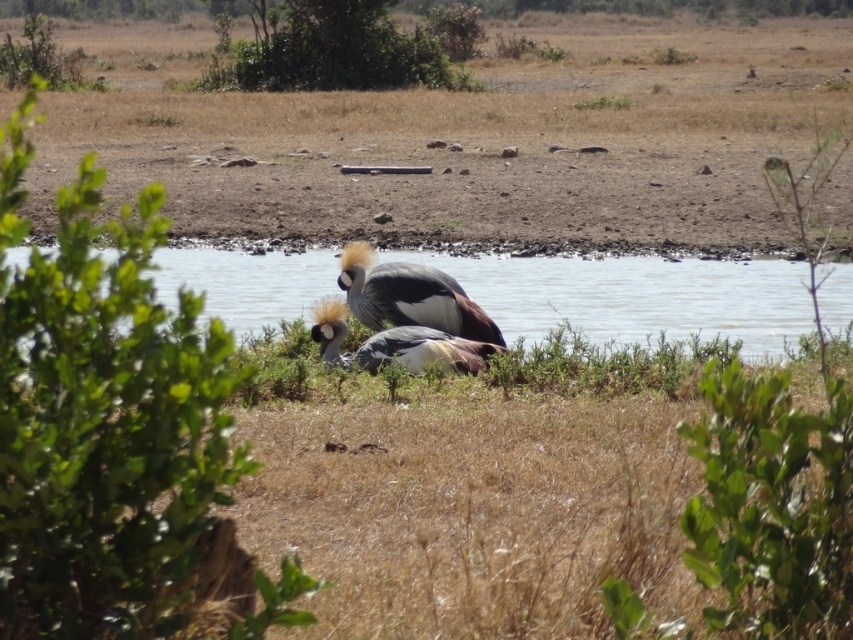
Question: Does clear water at center have a greater width compared to gray feathered bird at center?

Choices:
 (A) yes
 (B) no

Answer: (A)

Question: Does clear water at center appear on the left side of gray feathered bird at center?

Choices:
 (A) yes
 (B) no

Answer: (B)

Question: Does clear water at center have a greater width compared to gray feathered bird at center?

Choices:
 (A) yes
 (B) no

Answer: (A)

Question: Considering the real-world distances, which object is farthest from the gray feathered bird at center?

Choices:
 (A) clear water at center
 (B) gray matte bird at center

Answer: (A)

Question: Which is nearer to the clear water at center?

Choices:
 (A) gray matte bird at center
 (B) gray feathered bird at center

Answer: (B)

Question: Among these points, which one is farthest from the camera?

Choices:
 (A) (322, 356)
 (B) (494, 330)
 (C) (227, 300)

Answer: (C)